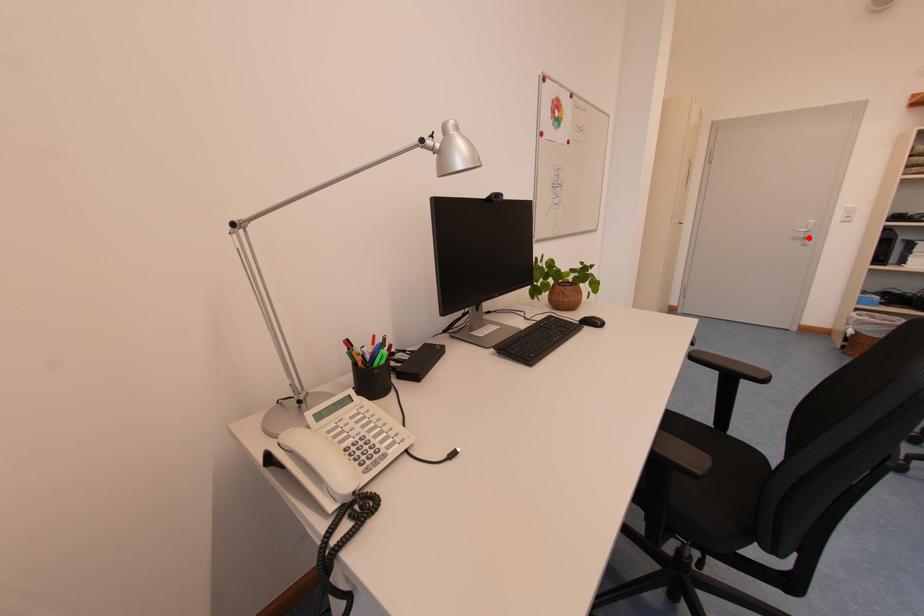
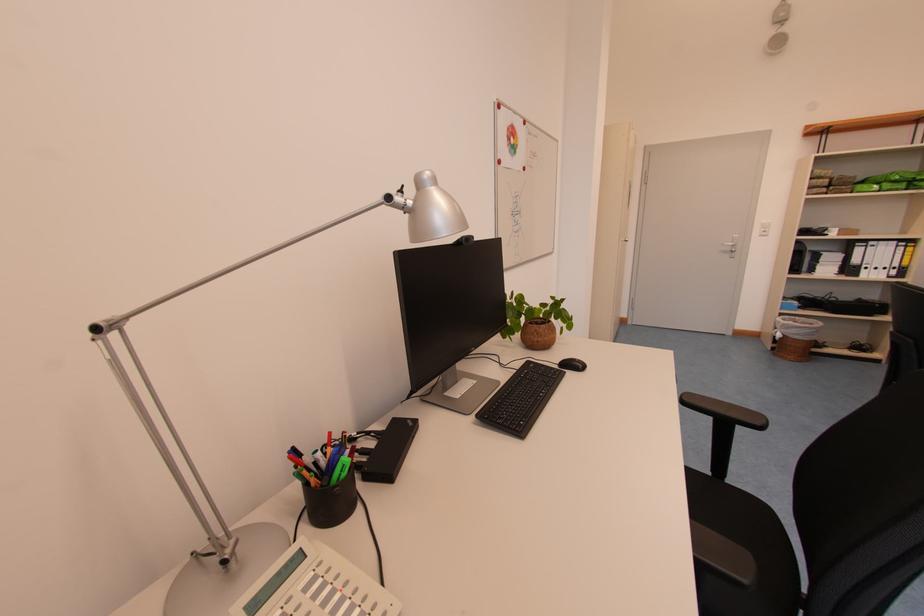
In the second image, find the point that corresponds to the highlighted location in the first image.

(736, 252)